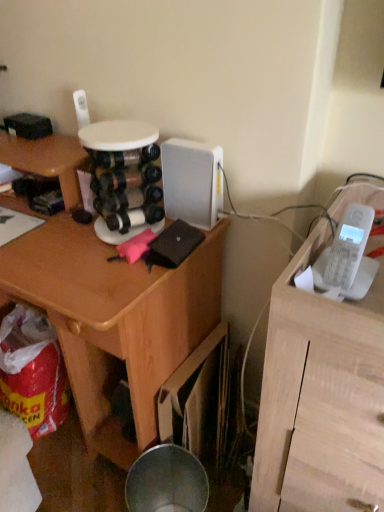
Question: Can you confirm if wooden desk at center is positioned to the right of white matte telephone at upper right?

Choices:
 (A) yes
 (B) no

Answer: (B)

Question: Is white matte telephone at upper right at the back of wooden desk at center?

Choices:
 (A) no
 (B) yes

Answer: (A)

Question: Can you confirm if wooden desk at center is bigger than white matte telephone at upper right?

Choices:
 (A) yes
 (B) no

Answer: (A)

Question: Is wooden desk at center oriented towards white matte telephone at upper right?

Choices:
 (A) yes
 (B) no

Answer: (B)

Question: From the image's perspective, would you say wooden desk at center is shown under white matte telephone at upper right?

Choices:
 (A) yes
 (B) no

Answer: (B)

Question: Considering the positions of wooden desk at center and white plastic phone at right in the image, is wooden desk at center bigger or smaller than white plastic phone at right?

Choices:
 (A) big
 (B) small

Answer: (A)

Question: In terms of width, does wooden desk at center look wider or thinner when compared to white plastic phone at right?

Choices:
 (A) wide
 (B) thin

Answer: (A)

Question: Is point (31, 275) positioned closer to the camera than point (327, 266)?

Choices:
 (A) farther
 (B) closer

Answer: (A)

Question: From the image's perspective, is wooden desk at center positioned above or below white plastic phone at right?

Choices:
 (A) below
 (B) above

Answer: (A)

Question: In terms of height, does white matte telephone at upper right look taller or shorter compared to wooden desk at center?

Choices:
 (A) short
 (B) tall

Answer: (B)

Question: From a real-world perspective, is white matte telephone at upper right positioned above or below wooden desk at center?

Choices:
 (A) below
 (B) above

Answer: (B)

Question: Considering the relative positions of white matte telephone at upper right and wooden desk at center in the image provided, is white matte telephone at upper right to the left or to the right of wooden desk at center?

Choices:
 (A) left
 (B) right

Answer: (B)

Question: Considering the positions of white matte telephone at upper right and wooden desk at center in the image, is white matte telephone at upper right bigger or smaller than wooden desk at center?

Choices:
 (A) small
 (B) big

Answer: (A)

Question: From the image's perspective, is white plastic phone at right located above or below white matte telephone at upper right?

Choices:
 (A) above
 (B) below

Answer: (A)

Question: Relative to white matte telephone at upper right, is white plastic phone at right in front or behind?

Choices:
 (A) behind
 (B) front

Answer: (A)